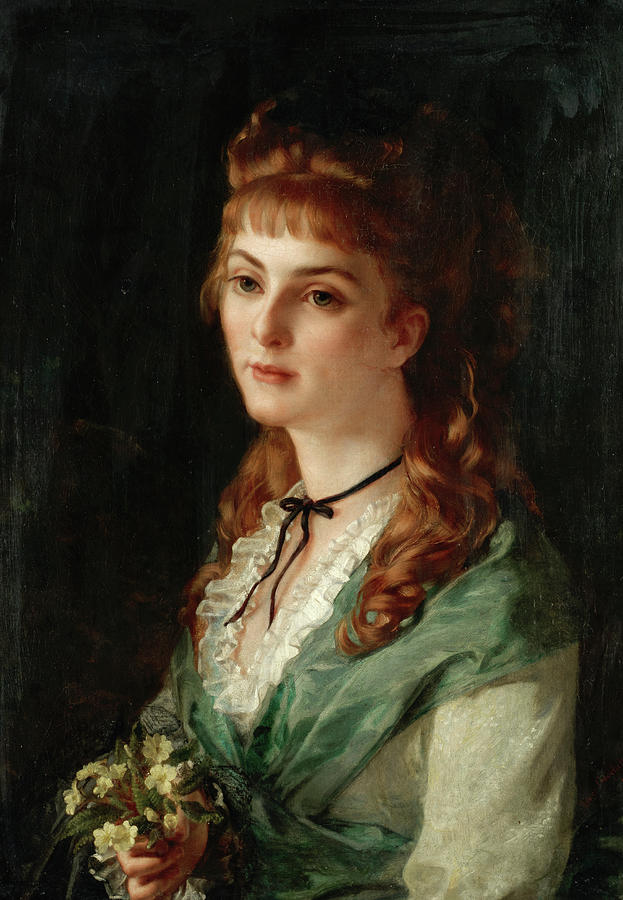
At what (x,y) coordinates should I click in order to perform the action: click on gallery. Please return your answer as a coordinate pair (x, y). The width and height of the screenshot is (623, 900). Looking at the image, I should click on (438, 756).